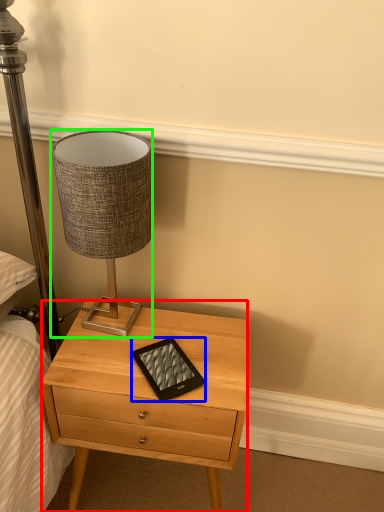
Question: Considering the real-world distances, which object is closest to nightstand (highlighted by a red box)? tablet computer (highlighted by a blue box) or lamp (highlighted by a green box).

Choices:
 (A) tablet computer
 (B) lamp

Answer: (A)